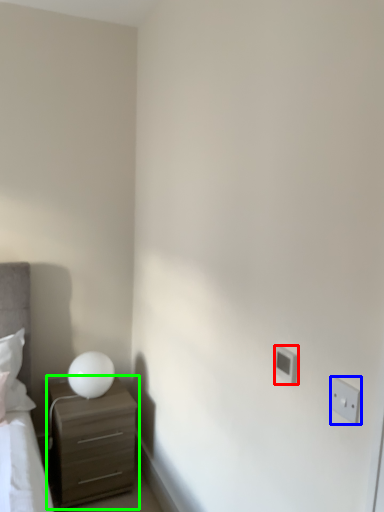
Question: Which object is positioned farthest from electric outlet (highlighted by a red box)? Select from electric outlet (highlighted by a blue box) and chest of drawers (highlighted by a green box).

Choices:
 (A) electric outlet
 (B) chest of drawers

Answer: (B)